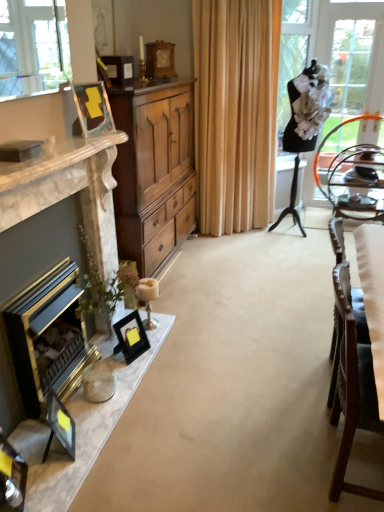
Question: Is matte black picture frame at lower left, the 5th picture frame viewed from the back, in front of or behind metallic silver tray at right in the image?

Choices:
 (A) front
 (B) behind

Answer: (A)

Question: Is point (51, 393) closer or farther from the camera than point (352, 203)?

Choices:
 (A) farther
 (B) closer

Answer: (B)

Question: Which is nearer to the wooden clock at upper center, arranged as the 5th picture frame when viewed from the front?

Choices:
 (A) metallic silver tray at right
 (B) clear glass door at right
 (C) matte black picture frame at upper center, the second picture frame viewed from the back
 (D) gold metallic fireplace at left, arranged as the first fireplace when viewed from the back
 (E) wooden cabinet at center

Answer: (C)

Question: Based on their relative distances, which object is nearer to the wooden chair at right?

Choices:
 (A) wooden cabinet at center
 (B) wooden clock at upper center, acting as the fifth picture frame starting from the bottom
 (C) matte black picture frame at upper center, marked as the 4th picture frame in a bottom-to-top arrangement
 (D) matte black picture frame at lower left, the 4th picture frame when ordered from top to bottom
 (E) marble fireplace at left, which appears as the 1th fireplace when viewed from the front

Answer: (D)